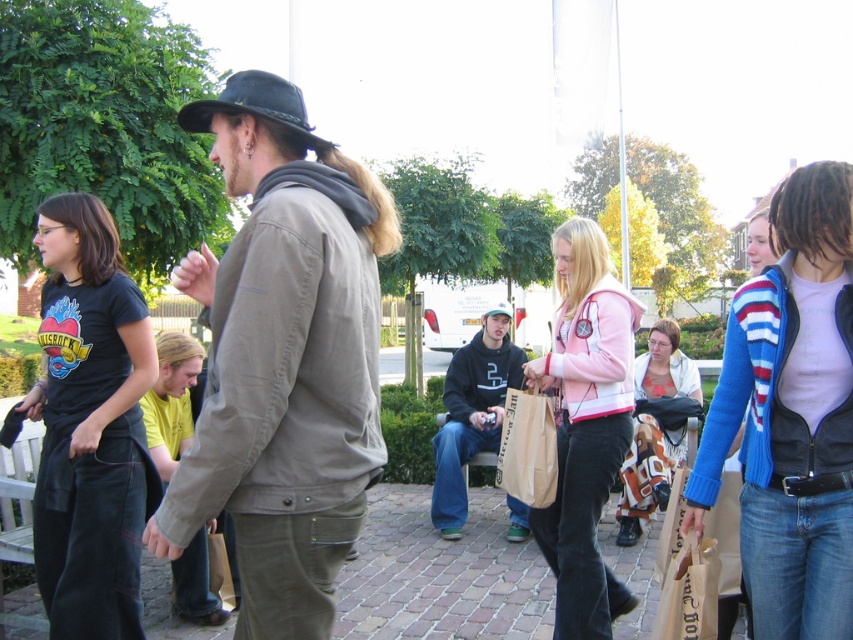
Question: Which point appears closest to the camera in this image?

Choices:
 (A) pyautogui.click(x=206, y=128)
 (B) pyautogui.click(x=471, y=406)
 (C) pyautogui.click(x=508, y=305)

Answer: (A)

Question: Considering the relative positions of khaki cotton jacket at center and brown brick pavement at center in the image provided, where is khaki cotton jacket at center located with respect to brown brick pavement at center?

Choices:
 (A) below
 (B) above

Answer: (B)

Question: Does blue striped sweater at center right appear under black felt fedora at upper center?

Choices:
 (A) yes
 (B) no

Answer: (A)

Question: Does brown brick pavement at center appear on the left side of dark blue jeans at center?

Choices:
 (A) no
 (B) yes

Answer: (B)

Question: Considering the real-world distances, which object is closest to the pink fleece jacket at center?

Choices:
 (A) dark blue jeans at center
 (B) black felt hat at center
 (C) black felt fedora at upper center
 (D) white cotton sweater at center

Answer: (D)

Question: Which of the following is the closest to the observer?

Choices:
 (A) dark blue jeans at center
 (B) black cotton t-shirt at left
 (C) pink fleece jacket at center
 (D) white cotton sweater at center

Answer: (B)